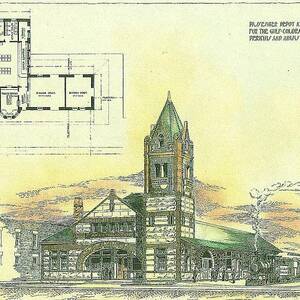
At what (x,y) coordinates should I click in order to perform the action: click on archway. Please return your answer as a coordinate pair (x, y). The height and width of the screenshot is (300, 300). Looking at the image, I should click on (110, 249), (207, 251).